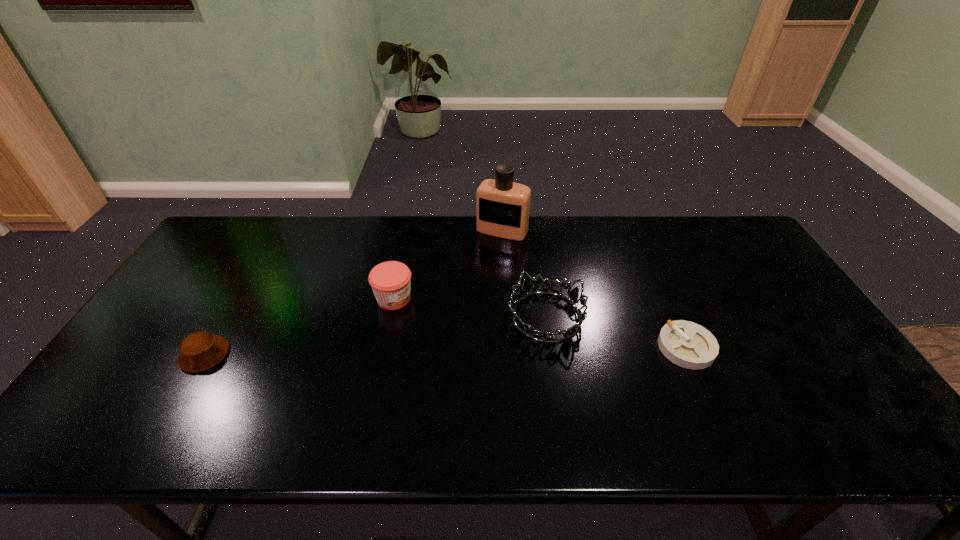
What are the coordinates of `the second shortest object` in the screenshot? It's located at (201, 350).

Locate an element on the screen. The width and height of the screenshot is (960, 540). muffin is located at coordinates (x=201, y=350).

Locate an element on the screen. The height and width of the screenshot is (540, 960). the rightmost object is located at coordinates (687, 344).

This screenshot has height=540, width=960. Find the location of `ashtray`. ashtray is located at coordinates (687, 344).

You are a GUI agent. You are given a task and a screenshot of the screen. Output one action in this format:
    pyautogui.click(x=<x>, y=<y>)
    Task: Click on the jam
    The image size is (960, 540).
    Given the screenshot: What is the action you would take?
    pyautogui.click(x=390, y=281)

Locate an element on the screen. The height and width of the screenshot is (540, 960). the tallest object is located at coordinates (502, 206).

Identify the location of the farthest object. pos(502,206).

You are a GUI agent. You are given a task and a screenshot of the screen. Output one action in this format:
    pyautogui.click(x=<x>, y=<y>)
    Task: Click on the tiara
    
    Given the screenshot: What is the action you would take?
    pyautogui.click(x=526, y=291)

You are a GUI agent. You are given a task and a screenshot of the screen. Output one action in this format:
    pyautogui.click(x=<x>, y=<y>)
    Task: Click on the free space located on the right of the leftmost object
    Image resolution: width=960 pixels, height=540 pixels.
    Given the screenshot: What is the action you would take?
    pyautogui.click(x=340, y=355)

At what (x,y) coordinates should I click in order to perform the action: click on blank space located 0.050m on the right of the rightmost object. Please return your answer as a coordinate pair (x, y). Image resolution: width=960 pixels, height=540 pixels. Looking at the image, I should click on (732, 347).